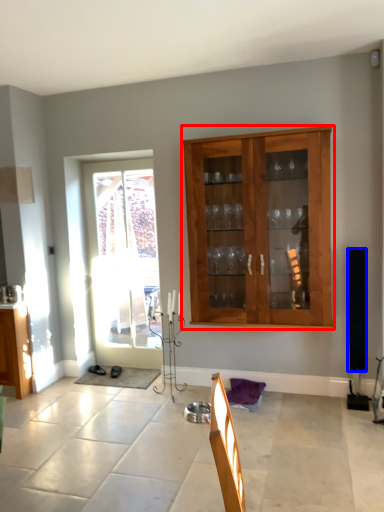
Question: Which object appears closest to the camera in this image, cabinet (highlighted by a red box) or loudspeaker (highlighted by a blue box)?

Choices:
 (A) cabinet
 (B) loudspeaker

Answer: (A)